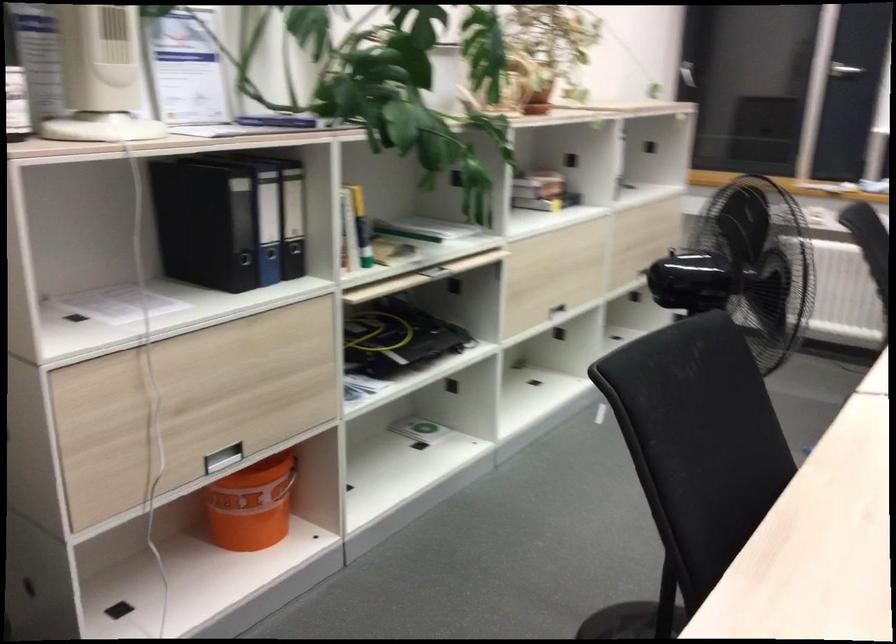
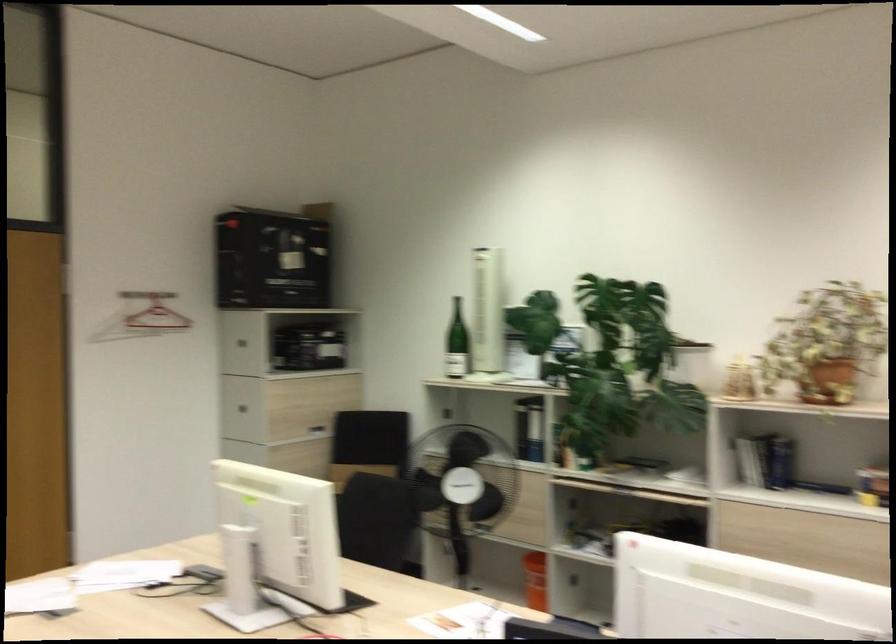
Find the pixel in the second image that matches (x=746, y=462) in the first image.

(376, 520)